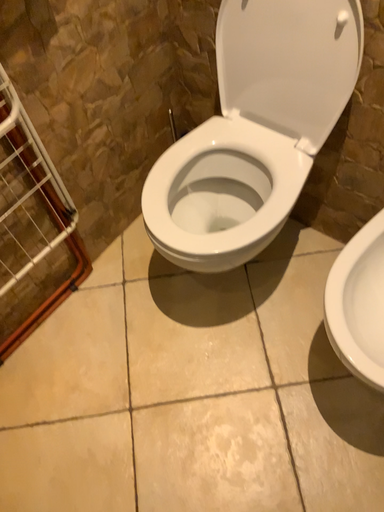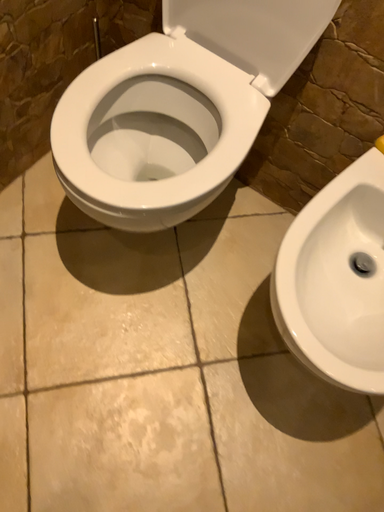
Question: Which way did the camera rotate in the video?

Choices:
 (A) rotated right
 (B) rotated left

Answer: (A)